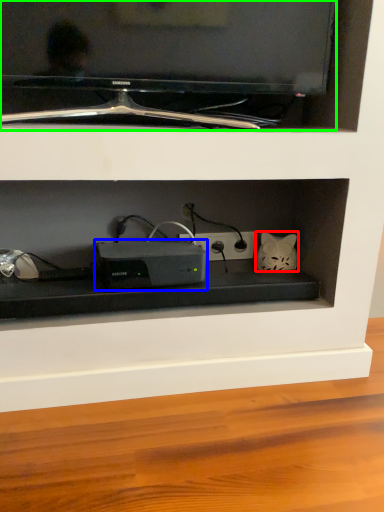
Question: Which object is positioned farthest from cat (highlighted by a red box)? Select from appliance (highlighted by a blue box) and television (highlighted by a green box).

Choices:
 (A) appliance
 (B) television

Answer: (B)